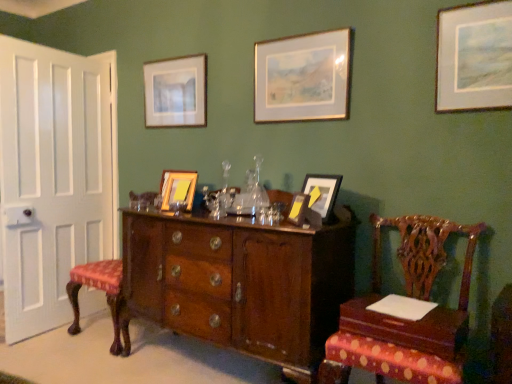
This screenshot has width=512, height=384. Identify the location of vacant space underneath polished wood cabinet at center (from a real-world perspective). (193, 362).